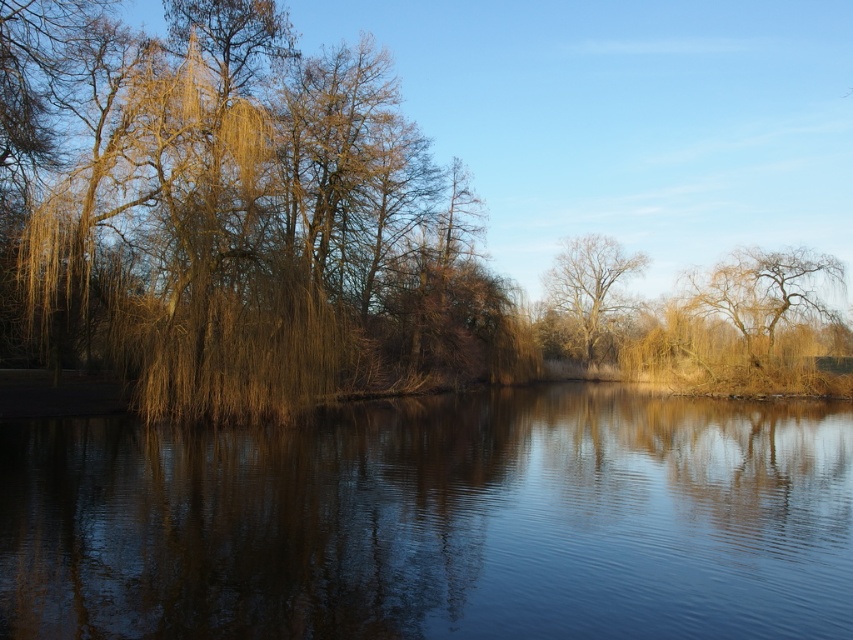
Question: Can you confirm if smooth water at center is positioned to the right of brown willow tree at left?

Choices:
 (A) yes
 (B) no

Answer: (A)

Question: Among these points, which one is farthest from the camera?

Choices:
 (A) (289, 362)
 (B) (312, 438)
 (C) (582, 300)

Answer: (C)

Question: Is brown willow tree at left above bare branches tree at center?

Choices:
 (A) no
 (B) yes

Answer: (B)

Question: Is brown willow tree at left closer to the viewer compared to bare branches tree at center?

Choices:
 (A) yes
 (B) no

Answer: (A)

Question: Estimate the real-world distances between objects in this image. Which object is farther from the smooth water at center?

Choices:
 (A) brown willow tree at left
 (B) bare branches tree at center

Answer: (B)

Question: Which object appears closest to the camera in this image?

Choices:
 (A) brown willow tree at left
 (B) bare branches tree at center

Answer: (A)